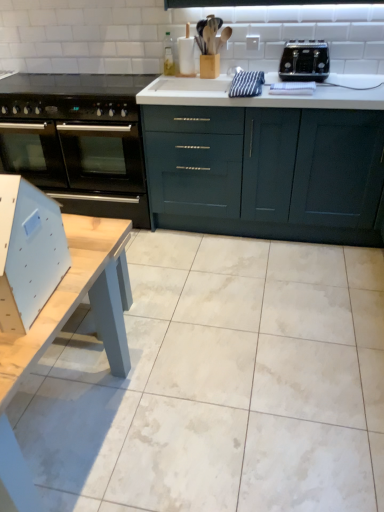
Question: Based on their positions, is light wood table at lower left located to the left or right of light blue plastic chair at lower left?

Choices:
 (A) right
 (B) left

Answer: (B)

Question: Is light wood table at lower left wider or thinner than light blue plastic chair at lower left?

Choices:
 (A) thin
 (B) wide

Answer: (B)

Question: Which is farther from the black glass oven at left?

Choices:
 (A) light blue plastic chair at lower left
 (B) matte dark blue cabinets at center
 (C) light wood table at lower left
 (D) black plastic toaster at upper right

Answer: (A)

Question: Which object is the closest to the matte dark blue cabinets at center?

Choices:
 (A) light wood table at lower left
 (B) light blue plastic chair at lower left
 (C) black plastic toaster at upper right
 (D) black glass oven at left

Answer: (C)